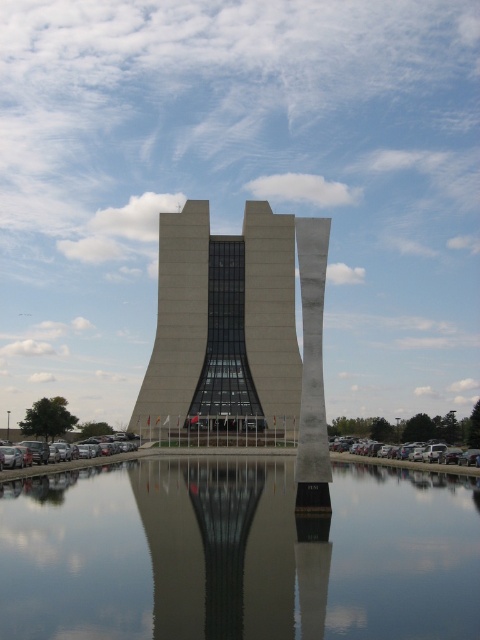
Does point (362, 445) come farther from viewer compared to point (92, 438)?

No.

Is point (368, 445) behind point (16, 464)?

Yes, it is.

You are a GUI agent. You are given a task and a screenshot of the screen. Output one action in this format:
    pyautogui.click(x=<x>, y=<y>)
    Task: Click on the silver metallic car at lower right
    The height and width of the screenshot is (640, 480).
    Given the screenshot: What is the action you would take?
    pyautogui.click(x=419, y=452)

Does gray concrete tower at center appear over silver metallic car at lower right?

Yes.

Looking at this image, who is more forward, (266, 314) or (456, 458)?

Point (456, 458) is more forward.

Describe the element at coordinates (224, 321) in the screenshot. The width and height of the screenshot is (480, 640). I see `gray concrete tower at center` at that location.

Where is `gray concrete tower at center`? gray concrete tower at center is located at coordinates (224, 321).

Which is in front, point (162, 524) or point (414, 452)?

Positioned in front is point (162, 524).

What do you see at coordinates (237, 554) in the screenshot?
I see `clear glass water at center` at bounding box center [237, 554].

Identify the location of clear glass water at center. Image resolution: width=480 pixels, height=640 pixels. (237, 554).